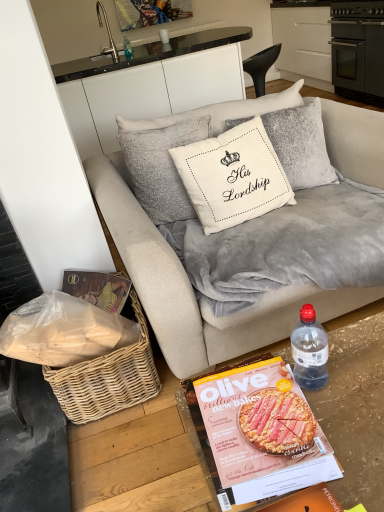
Question: Is silver metallic faucet at upper left wider or thinner than white glossy cup at upper center?

Choices:
 (A) thin
 (B) wide

Answer: (B)

Question: From the image's perspective, is silver metallic faucet at upper left positioned above or below white glossy cup at upper center?

Choices:
 (A) below
 (B) above

Answer: (A)

Question: Which is farther from the transparent plastic bottle at lower right, the 2th bottle when ordered from top to bottom?

Choices:
 (A) woven wicker basket at lower left
 (B) matte paper magazine at lower center
 (C) velvet beige couch at center
 (D) white cotton cushion at center
 (E) black matte oven at upper right

Answer: (E)

Question: Estimate the real-world distances between objects in this image. Which object is farther from the velvet beige couch at center?

Choices:
 (A) matte paper magazine at lower center
 (B) transparent plastic bottle at lower right, which is the first bottle in front-to-back order
 (C) velvet gray blanket at center
 (D) black matte oven at upper right
 (E) clear plastic bottle at upper center, the 2th bottle positioned from the bottom

Answer: (D)